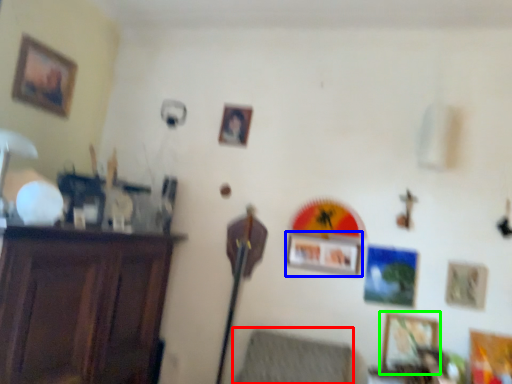
Question: Considering the real-world distances, which object is farthest from swivel chair (highlighted by a red box)? picture frame (highlighted by a blue box) or picture frame (highlighted by a green box)?

Choices:
 (A) picture frame
 (B) picture frame

Answer: (A)